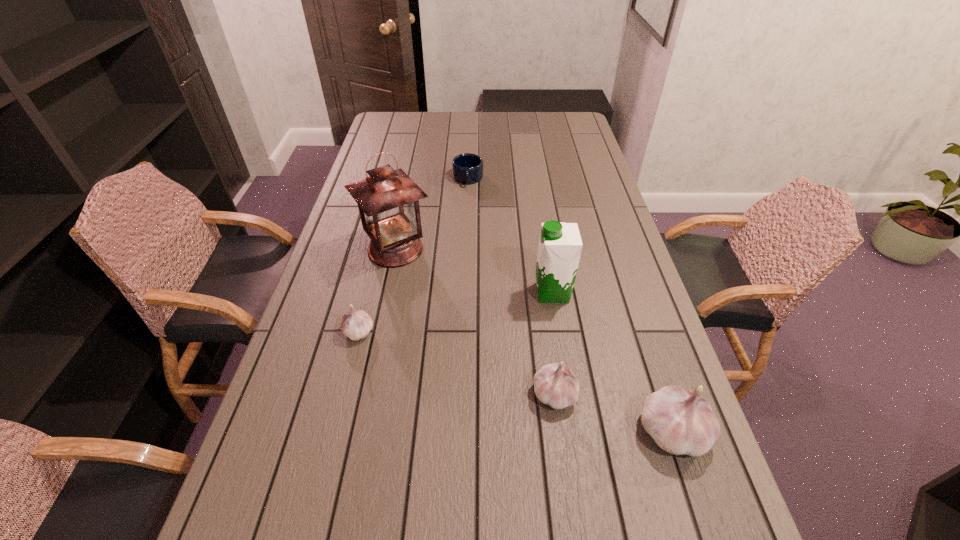
Where is `object present at the near edge`? object present at the near edge is located at coordinates (681, 422).

Identify the location of garlic positioned at the left edge. (356, 324).

Identify the location of oil lamp present at the left edge. Image resolution: width=960 pixels, height=540 pixels. (388, 200).

In order to click on object located in the right edge section of the desktop in this screenshot , I will do `click(681, 422)`.

Find the location of `object at the near right corner`. object at the near right corner is located at coordinates (681, 422).

In order to click on free location at the far edge in this screenshot , I will do `click(502, 116)`.

This screenshot has height=540, width=960. In the image, there is a desktop. Find the location of `blank space at the near edge`. blank space at the near edge is located at coordinates (564, 474).

The width and height of the screenshot is (960, 540). What are the coordinates of `vacant region at the left edge of the desktop` in the screenshot? It's located at (310, 301).

In the image, there is a desktop. Where is `vacant space at the right edge`? Image resolution: width=960 pixels, height=540 pixels. vacant space at the right edge is located at coordinates (624, 339).

This screenshot has height=540, width=960. I want to click on vacant space at the near left corner of the desktop, so click(263, 497).